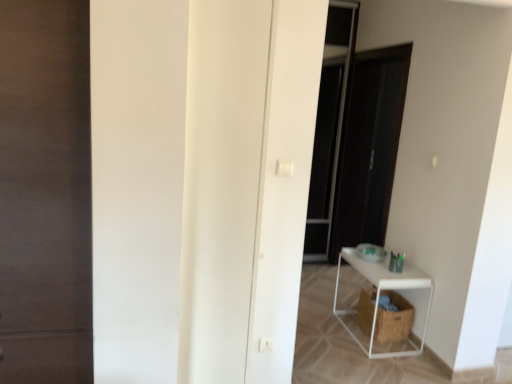
Question: Considering the positions of white matte door at center, the 2th door positioned from the left, and brown woven laundry basket at lower right in the image, is white matte door at center, the 2th door positioned from the left, bigger or smaller than brown woven laundry basket at lower right?

Choices:
 (A) small
 (B) big

Answer: (B)

Question: In the image, is white matte door at center, the 1th door in the right-to-left sequence, positioned in front of or behind brown woven laundry basket at lower right?

Choices:
 (A) behind
 (B) front

Answer: (B)

Question: Considering the real-world distances, which object is farthest from the dark wood door at left, which appears as the 2th door when viewed from the right?

Choices:
 (A) transparent glass screen door at center
 (B) brown woven laundry basket at lower right
 (C) white matte shelf at lower right
 (D) white matte door at center, the 1th door in the right-to-left sequence

Answer: (A)

Question: Estimate the real-world distances between objects in this image. Which object is closer to the transparent glass screen door at center?

Choices:
 (A) brown woven laundry basket at lower right
 (B) white matte shelf at lower right
 (C) white matte door at center, the 2th door positioned from the left
 (D) dark wood door at left, which appears as the 2th door when viewed from the right

Answer: (B)